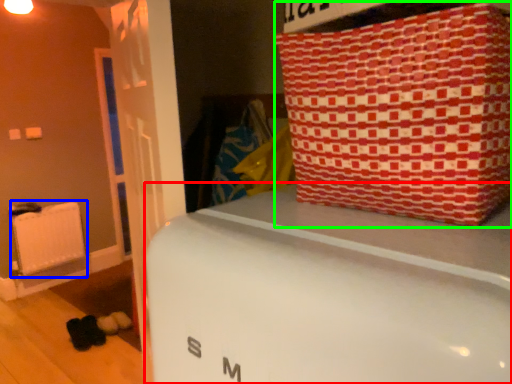
Question: Which object is the closest to the furniture (highlighted by a red box)? Choose among these: radiator (highlighted by a blue box) or package (highlighted by a green box).

Choices:
 (A) radiator
 (B) package

Answer: (B)